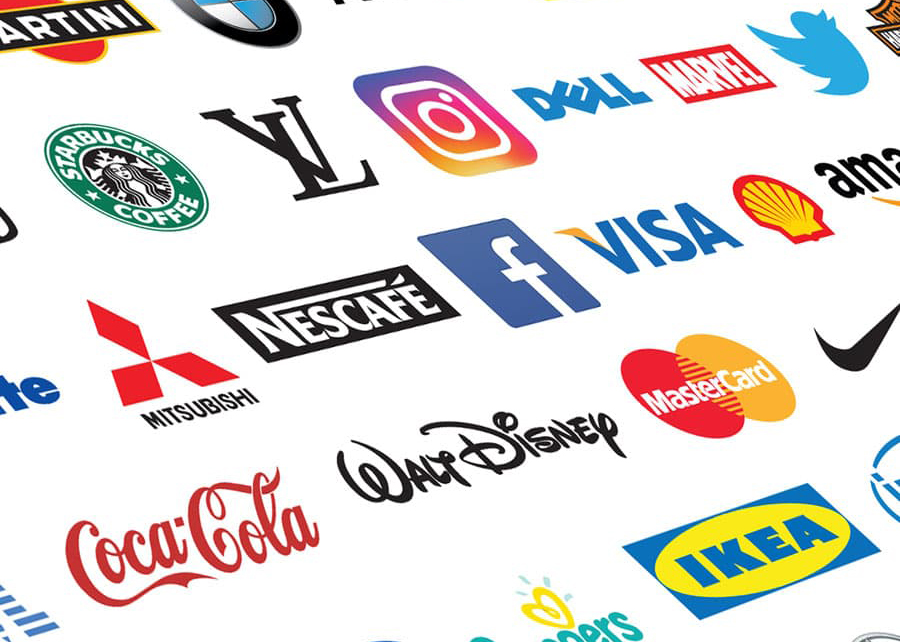
Identify the location of computer. This screenshot has height=642, width=900. (590, 76).